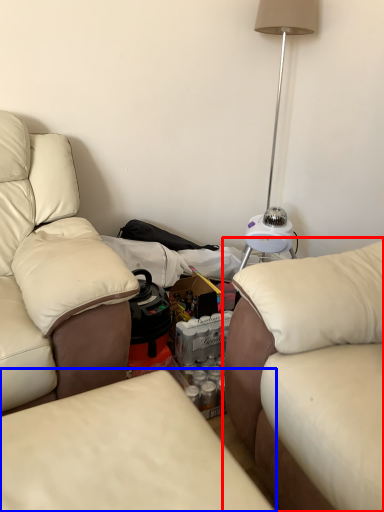
Question: Among these objects, which one is farthest to the camera, studio couch (highlighted by a red box) or studio couch (highlighted by a blue box)?

Choices:
 (A) studio couch
 (B) studio couch

Answer: (A)